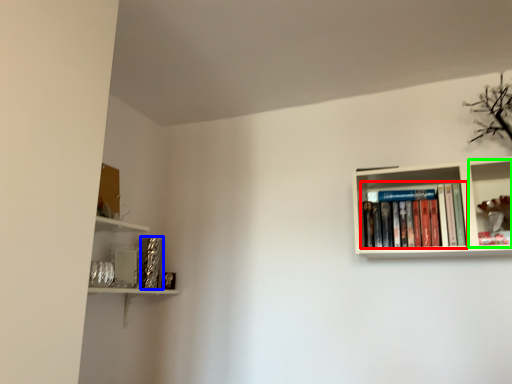
Question: Which is farther away from book (highlighted by a red box)? paperback book (highlighted by a blue box) or shelf (highlighted by a green box)?

Choices:
 (A) paperback book
 (B) shelf

Answer: (A)